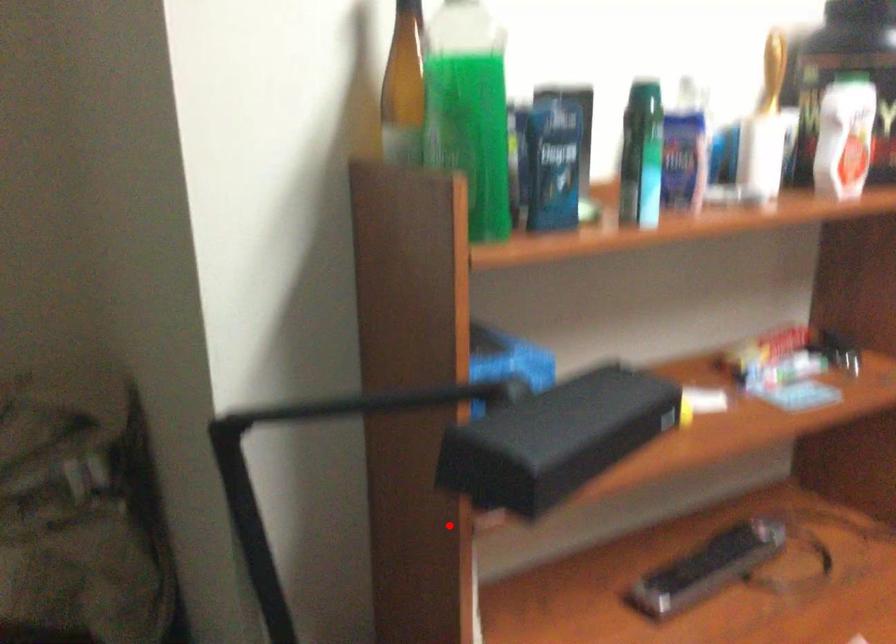
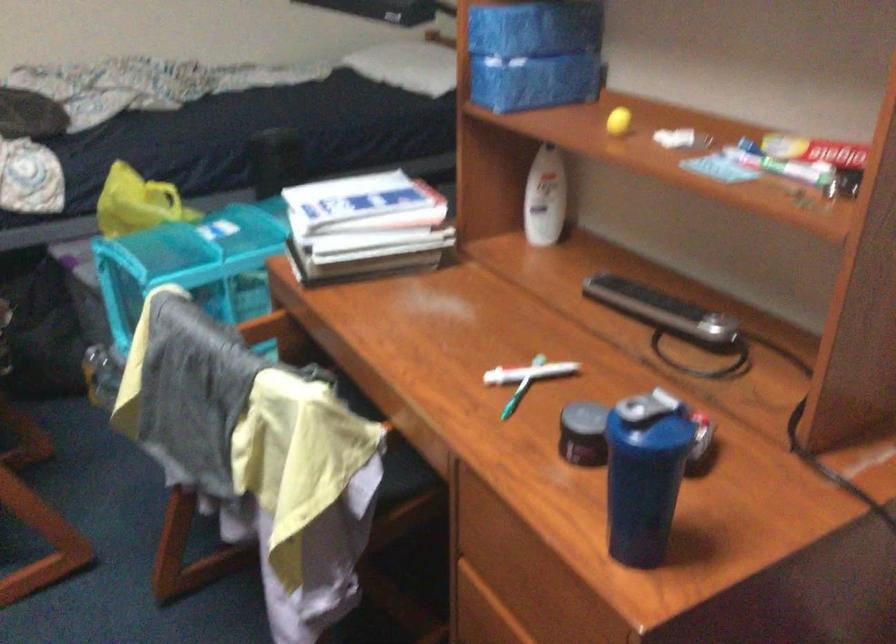
Question: I am providing you with two images of the same scene from different viewpoints. In image1, a red point is highlighted. Considering the same 3D point in image2, which of the following is correct?

Choices:
 (A) It is closer
 (B) It is farther

Answer: (B)